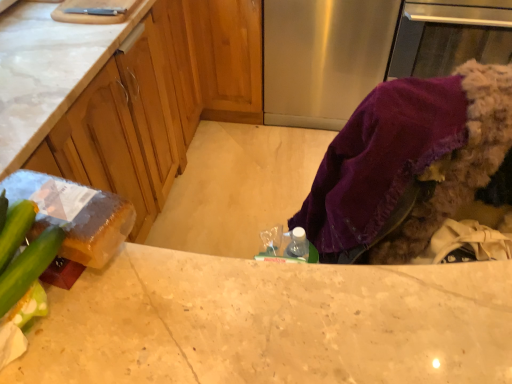
What do you see at coordinates (323, 58) in the screenshot?
I see `stainless steel refrigerator at center` at bounding box center [323, 58].

Identify the location of stainless steel refrigerator at center. (323, 58).

Looking at this image, from a real-world perspective, is green matte cucumber at lower left under matte wood cabinets at center?

No, from a real-world perspective, green matte cucumber at lower left is not beneath matte wood cabinets at center.

Does green matte cucumber at lower left have a lesser height compared to matte wood cabinets at center?

Correct, green matte cucumber at lower left is not as tall as matte wood cabinets at center.

Does green matte cucumber at lower left turn towards matte wood cabinets at center?

No, green matte cucumber at lower left is not aimed at matte wood cabinets at center.

Looking at this image, considering the relative positions of green matte cucumber at lower left and matte wood cabinets at center in the image provided, is green matte cucumber at lower left behind matte wood cabinets at center?

No.

Which is more to the right, green matte cucumber at lower left or stainless steel refrigerator at center?

stainless steel refrigerator at center.

In the scene shown: Is green matte cucumber at lower left oriented towards stainless steel refrigerator at center?

No, green matte cucumber at lower left is not facing towards stainless steel refrigerator at center.

Is green matte cucumber at lower left shorter than stainless steel refrigerator at center?

Yes, green matte cucumber at lower left is shorter than stainless steel refrigerator at center.

At what (x,y) coordinates should I click in order to perform the action: click on appliance below the green matte cucumber at lower left (from a real-world perspective). Please return your answer as a coordinate pair (x, y). This screenshot has height=384, width=512. Looking at the image, I should click on (323, 58).

Are matte wood cabinets at center and marble countertop at center located far from each other?

They are positioned close to each other.

Could you tell me if matte wood cabinets at center is facing marble countertop at center?

Yes, matte wood cabinets at center is oriented towards marble countertop at center.

Where is `cabinetry above the marble countertop at center (from a real-world perspective)`? This screenshot has height=384, width=512. cabinetry above the marble countertop at center (from a real-world perspective) is located at coordinates (163, 100).

Between matte wood cabinets at center and marble countertop at center, which one has larger width?

matte wood cabinets at center.

Looking at this image, from a real-world perspective, which is physically below, green matte cucumber at lower left or marble countertop at center?

From a 3D spatial view, marble countertop at center is below.

Which object is wider, green matte cucumber at lower left or marble countertop at center?

marble countertop at center is wider.

Which is closer, (25, 266) or (378, 352)?

Point (25, 266).

Is green matte cucumber at lower left further to the viewer compared to marble countertop at center?

No, green matte cucumber at lower left is in front of marble countertop at center.

From the image's perspective, relative to purple fabric at lower right, is matte wood cabinets at center above or below?

matte wood cabinets at center is above purple fabric at lower right.

Is point (148, 142) closer or farther from the camera than point (395, 255)?

Point (148, 142) is positioned farther from the camera compared to point (395, 255).

Is purple fabric at lower right facing away from marble countertop at center?

Yes, purple fabric at lower right is positioned with its back facing marble countertop at center.

Which is correct: purple fabric at lower right is inside marble countertop at center, or outside of it?

purple fabric at lower right cannot be found inside marble countertop at center.

From a real-world perspective, is purple fabric at lower right beneath marble countertop at center?

Incorrect, from a real-world perspective, purple fabric at lower right is higher than marble countertop at center.

Does purple fabric at lower right have a greater width compared to marble countertop at center?

Yes, purple fabric at lower right is wider than marble countertop at center.

Can you confirm if marble countertop at center is bigger than purple fabric at lower right?

Yes.

Considering the relative sizes of marble countertop at center and purple fabric at lower right in the image provided, is marble countertop at center shorter than purple fabric at lower right?

No, marble countertop at center is not shorter than purple fabric at lower right.

Based on the photo, considering the relative positions of marble countertop at center and purple fabric at lower right in the image provided, is marble countertop at center to the left or to the right of purple fabric at lower right?

In the image, marble countertop at center appears on the left side of purple fabric at lower right.

Where is `cabinetry on the left of green matte cucumber at lower left`? cabinetry on the left of green matte cucumber at lower left is located at coordinates (163, 100).

The image size is (512, 384). I want to click on appliance lying above the green matte cucumber at lower left (from the image's perspective), so click(323, 58).

Considering their positions, is stainless steel refrigerator at center positioned further to purple fabric at lower right than matte wood cabinets at center?

The object further to purple fabric at lower right is stainless steel refrigerator at center.

Considering their positions, is purple fabric at lower right positioned further to stainless steel refrigerator at center than green matte cucumber at lower left?

Based on the image, green matte cucumber at lower left appears to be further to stainless steel refrigerator at center.

When comparing their distances from marble countertop at center, does green matte cucumber at lower left or matte wood cabinets at center seem closer?

Among the two, green matte cucumber at lower left is located nearer to marble countertop at center.

Considering their positions, is marble countertop at center positioned further to green matte cucumber at lower left than stainless steel refrigerator at center?

Among the two, stainless steel refrigerator at center is located further to green matte cucumber at lower left.

Based on their spatial positions, is green matte cucumber at lower left or marble countertop at center further from purple fabric at lower right?

green matte cucumber at lower left is further to purple fabric at lower right.

When comparing their distances from green matte cucumber at lower left, does purple fabric at lower right or marble countertop at center seem closer?

Among the two, marble countertop at center is located nearer to green matte cucumber at lower left.

Estimate the real-world distances between objects in this image. Which object is further from marble countertop at center, green matte cucumber at lower left or stainless steel refrigerator at center?

Among the two, stainless steel refrigerator at center is located further to marble countertop at center.

From the image, which object appears to be nearer to marble countertop at center, green matte cucumber at lower left or purple fabric at lower right?

Based on the image, green matte cucumber at lower left appears to be nearer to marble countertop at center.

In order to click on clothing located between marble countertop at center and stainless steel refrigerator at center in the depth direction in this screenshot , I will do `click(408, 164)`.

Where is `countertop between green matte cucumber at lower left and purple fabric at lower right in the horizontal direction`? This screenshot has height=384, width=512. countertop between green matte cucumber at lower left and purple fabric at lower right in the horizontal direction is located at coordinates (272, 323).

Find the location of a particular element. The image size is (512, 384). cabinetry positioned between marble countertop at center and stainless steel refrigerator at center from near to far is located at coordinates (163, 100).

Identify the location of cabinetry between purple fabric at lower right and stainless steel refrigerator at center in the front-back direction. The image size is (512, 384). (163, 100).